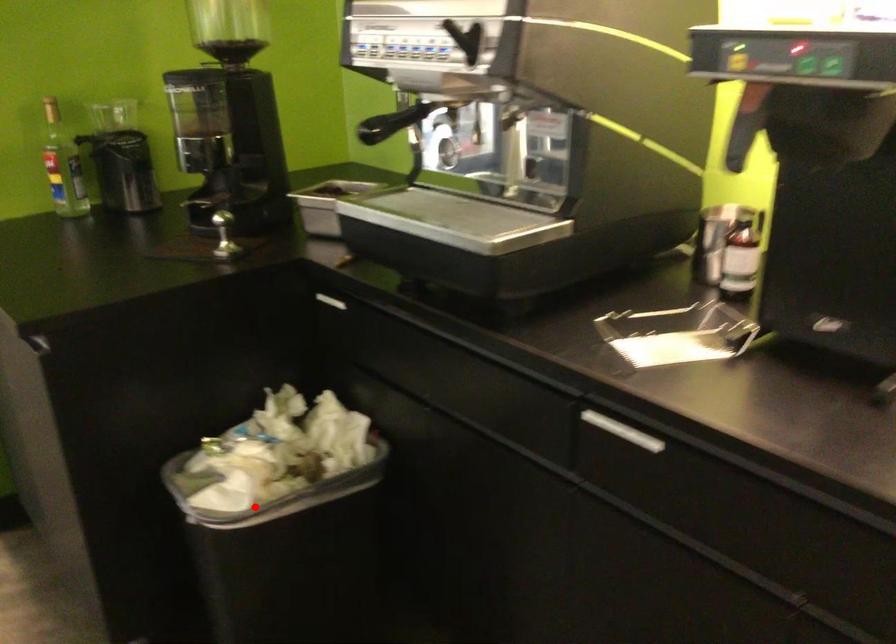
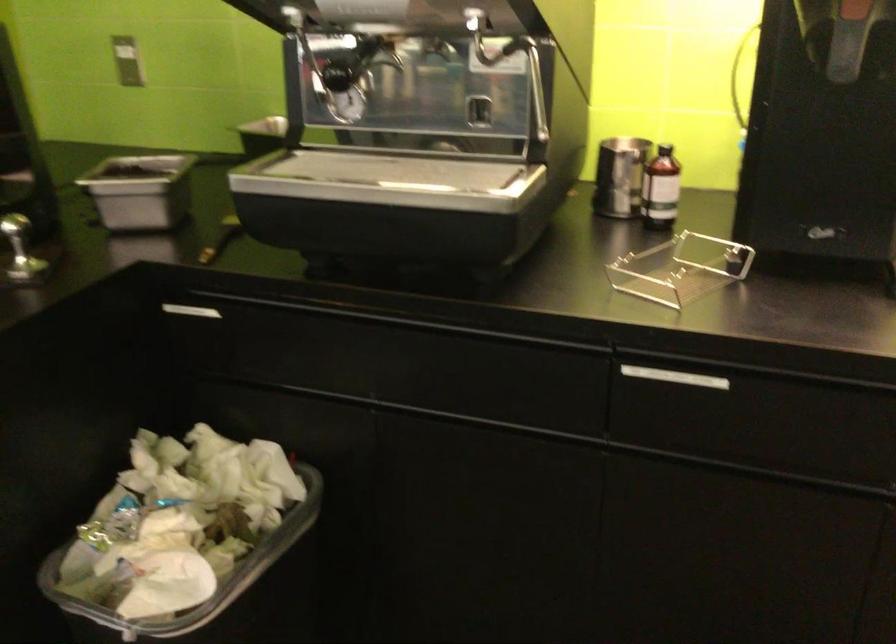
Question: I am providing you with two images of the same scene from different viewpoints. A red point is marked on the first image. At the location where the point appears in image 1, is it still visible in image 2?

Choices:
 (A) Yes
 (B) No

Answer: (A)